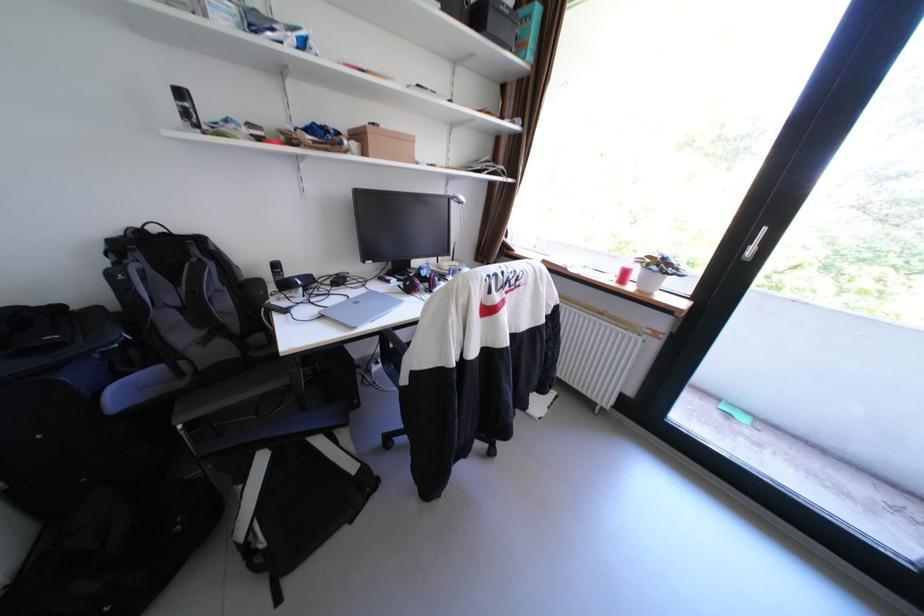
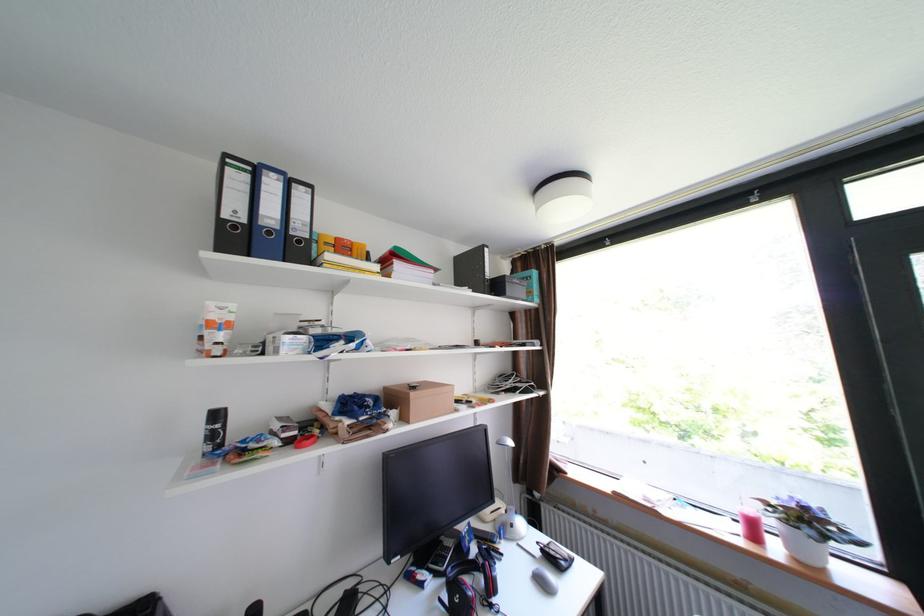
Locate, in the second image, the point that corresponds to point (375, 153) in the first image.

(415, 419)